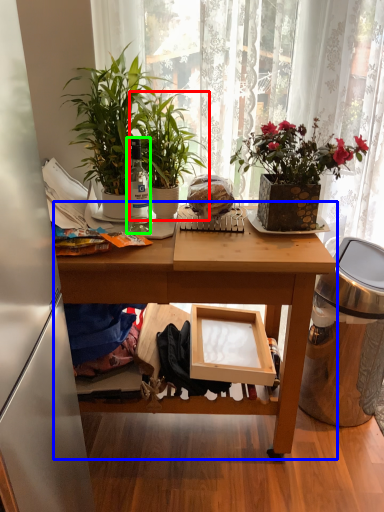
Question: Which object is the closest to the houseplant (highlighted by a red box)? Choose among these: table (highlighted by a blue box) or bottle (highlighted by a green box).

Choices:
 (A) table
 (B) bottle

Answer: (B)